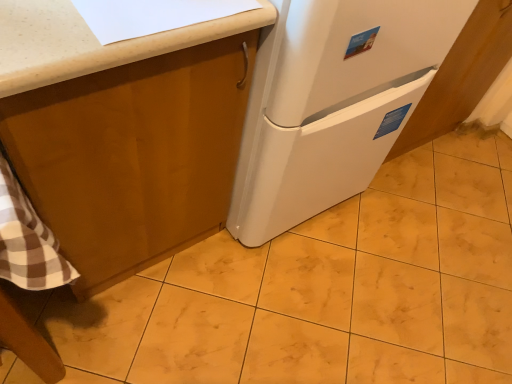
Question: Can you confirm if white matte refrigerator at center is bigger than white glossy cabinet at lower right, arranged as the second cabinetry when viewed from the left?

Choices:
 (A) yes
 (B) no

Answer: (A)

Question: Is white matte refrigerator at center located outside white glossy cabinet at lower right, arranged as the second cabinetry when viewed from the left?

Choices:
 (A) no
 (B) yes

Answer: (B)

Question: Does white matte refrigerator at center lie in front of white glossy cabinet at lower right, the 1th cabinetry in the right-to-left sequence?

Choices:
 (A) yes
 (B) no

Answer: (A)

Question: Is white glossy cabinet at lower right, arranged as the second cabinetry when viewed from the left, surrounded by white matte refrigerator at center?

Choices:
 (A) yes
 (B) no

Answer: (B)

Question: Could you tell me if white matte refrigerator at center is facing white glossy cabinet at lower right, arranged as the second cabinetry when viewed from the left?

Choices:
 (A) yes
 (B) no

Answer: (B)

Question: Is white matte refrigerator at center oriented away from white glossy cabinet at lower right, the 1th cabinetry in the right-to-left sequence?

Choices:
 (A) no
 (B) yes

Answer: (A)

Question: From the image's perspective, is yellow marble tile at center above matte wood cabinet at upper left, which ranks as the 2th cabinetry in right-to-left order?

Choices:
 (A) no
 (B) yes

Answer: (A)

Question: From a real-world perspective, is yellow marble tile at center located higher than matte wood cabinet at upper left, marked as the first cabinetry in a left-to-right arrangement?

Choices:
 (A) yes
 (B) no

Answer: (B)

Question: Is matte wood cabinet at upper left, which ranks as the 2th cabinetry in right-to-left order, a part of yellow marble tile at center?

Choices:
 (A) no
 (B) yes

Answer: (A)

Question: Is the position of yellow marble tile at center more distant than that of matte wood cabinet at upper left, marked as the first cabinetry in a left-to-right arrangement?

Choices:
 (A) no
 (B) yes

Answer: (B)

Question: Can you confirm if yellow marble tile at center is positioned to the left of matte wood cabinet at upper left, marked as the first cabinetry in a left-to-right arrangement?

Choices:
 (A) yes
 (B) no

Answer: (B)

Question: Considering the relative sizes of yellow marble tile at center and matte wood cabinet at upper left, marked as the first cabinetry in a left-to-right arrangement, in the image provided, is yellow marble tile at center bigger than matte wood cabinet at upper left, marked as the first cabinetry in a left-to-right arrangement,?

Choices:
 (A) no
 (B) yes

Answer: (A)

Question: Is white glossy cabinet at lower right, the 1th cabinetry in the right-to-left sequence, beside yellow marble tile at center?

Choices:
 (A) no
 (B) yes

Answer: (A)